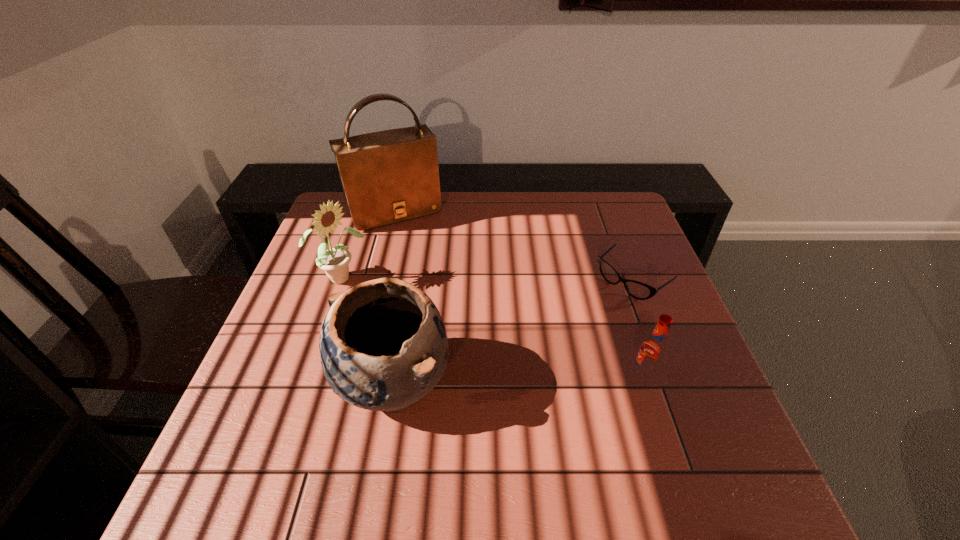
The width and height of the screenshot is (960, 540). Find the location of `free point that satisfies the following two spatial constraints: 1. on the back side of the root beer; 2. on the left side of the spectacles`. free point that satisfies the following two spatial constraints: 1. on the back side of the root beer; 2. on the left side of the spectacles is located at coordinates 612,282.

Identify the location of free location that satisfies the following two spatial constraints: 1. on the front side of the sunflower; 2. on the right side of the pottery. (304, 383).